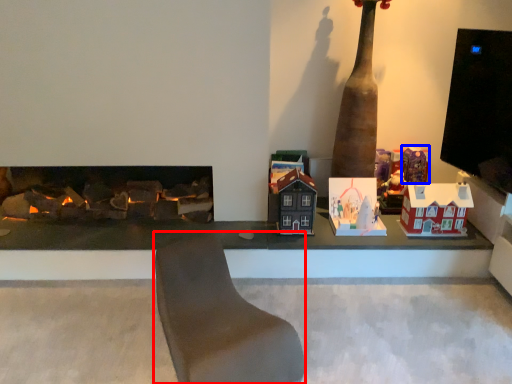
Question: Which point is further to the camera, furniture (highlighted by a red box) or toy (highlighted by a blue box)?

Choices:
 (A) furniture
 (B) toy

Answer: (B)